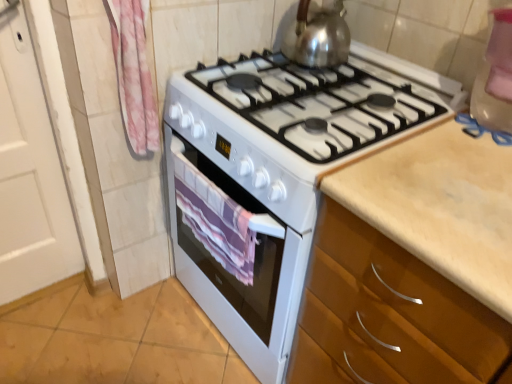
Question: Considering the relative sizes of pink fabric towel at left and white glossy stove at center in the image provided, is pink fabric towel at left taller than white glossy stove at center?

Choices:
 (A) yes
 (B) no

Answer: (B)

Question: From a real-world perspective, is pink fabric towel at left positioned over white glossy stove at center based on gravity?

Choices:
 (A) no
 (B) yes

Answer: (B)

Question: Could you tell me if pink fabric towel at left is turned towards white glossy stove at center?

Choices:
 (A) yes
 (B) no

Answer: (B)

Question: Does pink fabric towel at left have a lesser height compared to white glossy stove at center?

Choices:
 (A) yes
 (B) no

Answer: (A)

Question: Considering the relative sizes of pink fabric towel at left and white glossy stove at center in the image provided, is pink fabric towel at left bigger than white glossy stove at center?

Choices:
 (A) yes
 (B) no

Answer: (B)

Question: Does point (206, 236) appear closer or farther from the camera than point (345, 56)?

Choices:
 (A) closer
 (B) farther

Answer: (A)

Question: From the image's perspective, is purple striped towel at center located above or below shiny metallic kettle at upper center?

Choices:
 (A) above
 (B) below

Answer: (B)

Question: Would you say purple striped towel at center is to the left or to the right of shiny metallic kettle at upper center in the picture?

Choices:
 (A) right
 (B) left

Answer: (B)

Question: Is purple striped towel at center wider or thinner than shiny metallic kettle at upper center?

Choices:
 (A) thin
 (B) wide

Answer: (A)

Question: Does point [340, 14] appear closer or farther from the camera than point [302, 261]?

Choices:
 (A) closer
 (B) farther

Answer: (B)

Question: Is shiny metallic kettle at upper center in front of or behind white glossy stove at center in the image?

Choices:
 (A) behind
 (B) front

Answer: (A)

Question: Considering the positions of shiny metallic kettle at upper center and white glossy stove at center in the image, is shiny metallic kettle at upper center bigger or smaller than white glossy stove at center?

Choices:
 (A) big
 (B) small

Answer: (B)

Question: From the image's perspective, is shiny metallic kettle at upper center located above or below white glossy stove at center?

Choices:
 (A) below
 (B) above

Answer: (B)

Question: From the image's perspective, is white glossy stove at center positioned above or below pink fabric towel at left?

Choices:
 (A) below
 (B) above

Answer: (A)

Question: Do you think white glossy stove at center is within pink fabric towel at left, or outside of it?

Choices:
 (A) inside
 (B) outside

Answer: (B)